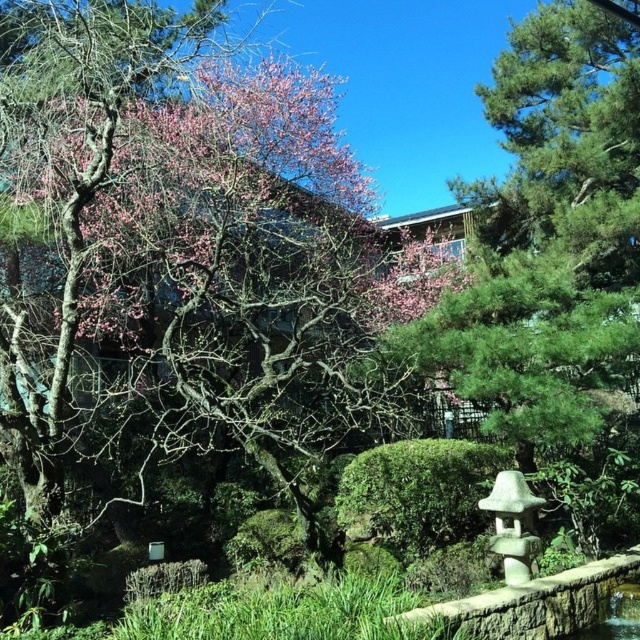
You are a landscape designer assessing the garden layout. You notice the pink textured bark at upper left and the green textured pine tree at center. Which of these two elements has a larger visual presence in the scene?

The pink textured bark at upper left has a larger visual presence than the green textured pine tree at center according to the description.

You are a gardener planning to plant a new flower bed between the pink textured bark at upper left and the white stone lantern at lower right. Based on their positions, which object should you start measuring from to ensure the flower bed is centered?

The pink textured bark at upper left is positioned on the left side of the white stone lantern at lower right. To center the flower bed between them, you should start measuring from the pink textured bark at upper left as it is the leftmost point.

Looking at this image, you are planning to plant a new flower bed between the pink textured bark at upper left and the green textured pine tree at center. Based on their current positions, which side of the pine tree should the flower bed be placed?

The flower bed should be placed on the left side of the green textured pine tree at center since the pink textured bark at upper left is already positioned on its left side.